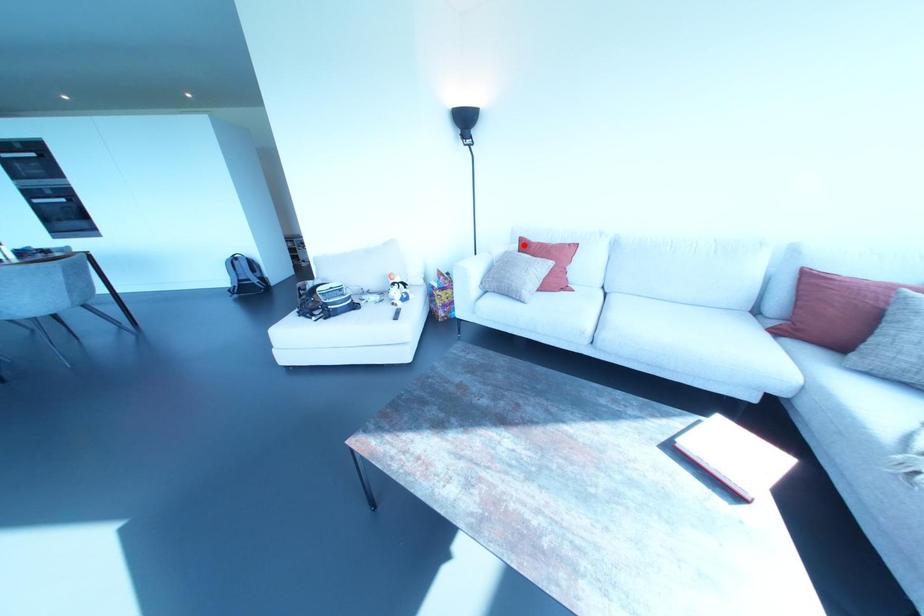
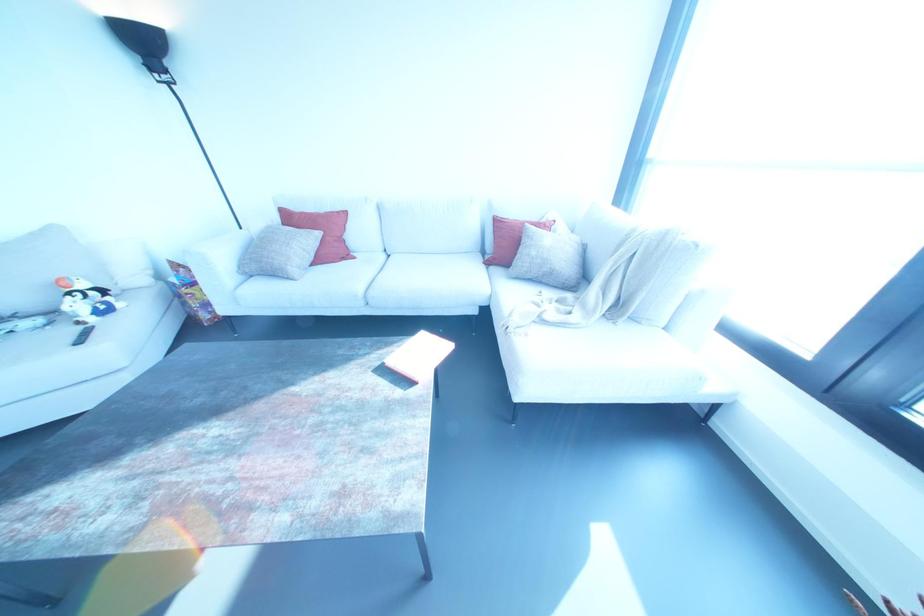
Find the pixel in the second image that matches the highlighted location in the first image.

(286, 217)